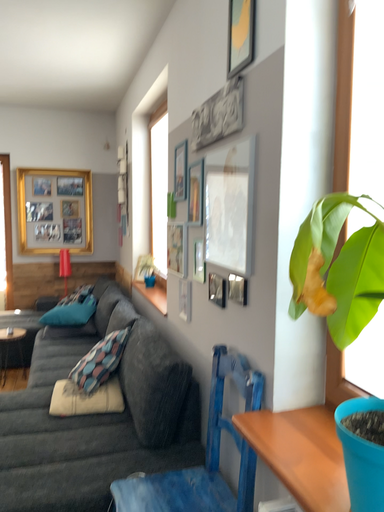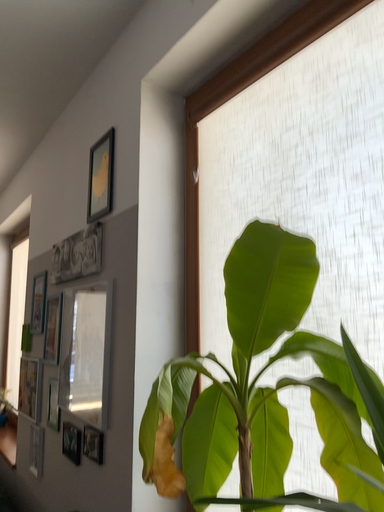
Question: Which way did the camera rotate in the video?

Choices:
 (A) rotated right
 (B) rotated left

Answer: (A)